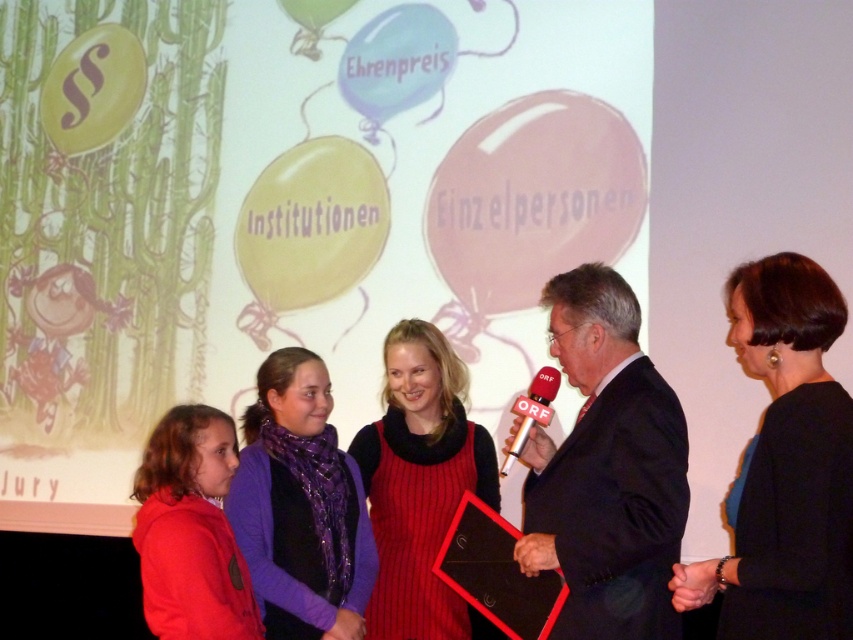
You are a photographer at the event and need to capture a clear photo of both the matte red dress at center and the red plastic microphone at center. Which object should you focus on first to ensure it appears sharp in the photo?

The matte red dress at center is larger in size than the red plastic microphone at center, so you should focus on the matte red dress at center first to ensure it appears sharp in the photo.

What are the coordinates of the black suit at center?

The coordinates of the black suit at center are at point [606,468].

From the picture: You are a photographer at the event and need to capture a photo of the two central items. Since the matte red dress at center is taller than the red plastic microphone at center, which object should you focus on first to ensure both are in frame?

The matte red dress at center is taller than the red plastic microphone at center, so you should focus on the taller matte red dress at center first to ensure both are in frame.